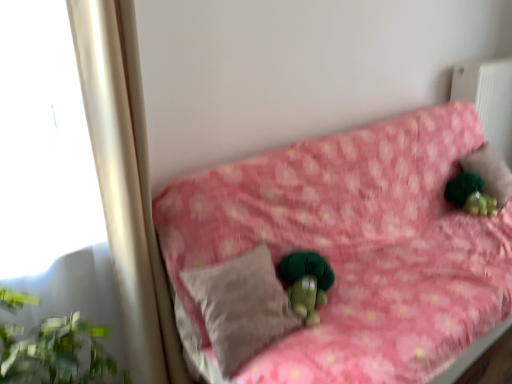
Question: In which direction should I rotate to look at beige soft pillow at center, positioned as the 2th pillow in right-to-left order?

Choices:
 (A) right
 (B) left

Answer: (B)

Question: Is pink floral fabric couch at center further to camera compared to beige soft pillow at center, positioned as the 2th pillow in right-to-left order?

Choices:
 (A) yes
 (B) no

Answer: (B)

Question: Are pink floral fabric couch at center and beige soft pillow at center, positioned as the 2th pillow in right-to-left order, located far from each other?

Choices:
 (A) yes
 (B) no

Answer: (B)

Question: Is pink floral fabric couch at center located outside beige soft pillow at center, acting as the second pillow starting from the back?

Choices:
 (A) yes
 (B) no

Answer: (A)

Question: Is pink floral fabric couch at center next to beige soft pillow at center, positioned as the 2th pillow in right-to-left order, and touching it?

Choices:
 (A) no
 (B) yes

Answer: (A)

Question: Is beige soft pillow at center, acting as the 2th pillow starting from the top, at the back of pink floral fabric couch at center?

Choices:
 (A) no
 (B) yes

Answer: (B)

Question: Is pink floral fabric couch at center facing towards beige soft pillow at center, marked as the 1th pillow in a front-to-back arrangement?

Choices:
 (A) no
 (B) yes

Answer: (A)

Question: Does green fuzzy figurine at upper right lie behind beige fabric pillow at upper right, the second pillow positioned from the bottom?

Choices:
 (A) no
 (B) yes

Answer: (A)

Question: Considering the relative sizes of green fuzzy figurine at upper right and beige fabric pillow at upper right, which is the second pillow from front to back, in the image provided, is green fuzzy figurine at upper right wider than beige fabric pillow at upper right, which is the second pillow from front to back,?

Choices:
 (A) no
 (B) yes

Answer: (A)

Question: Is green fuzzy figurine at upper right taller than beige fabric pillow at upper right, the second pillow viewed from the left?

Choices:
 (A) yes
 (B) no

Answer: (B)

Question: Is green fuzzy figurine at upper right closer to the viewer compared to beige fabric pillow at upper right, which is the 1th pillow in right-to-left order?

Choices:
 (A) no
 (B) yes

Answer: (B)

Question: Are green fuzzy figurine at upper right and beige fabric pillow at upper right, the second pillow positioned from the bottom, beside each other?

Choices:
 (A) no
 (B) yes

Answer: (A)

Question: Is green fuzzy figurine at upper right facing towards beige fabric pillow at upper right, which is the 1th pillow in right-to-left order?

Choices:
 (A) yes
 (B) no

Answer: (B)

Question: Are green fuzzy figurine at upper right and pink floral fabric couch at center located far from each other?

Choices:
 (A) yes
 (B) no

Answer: (B)